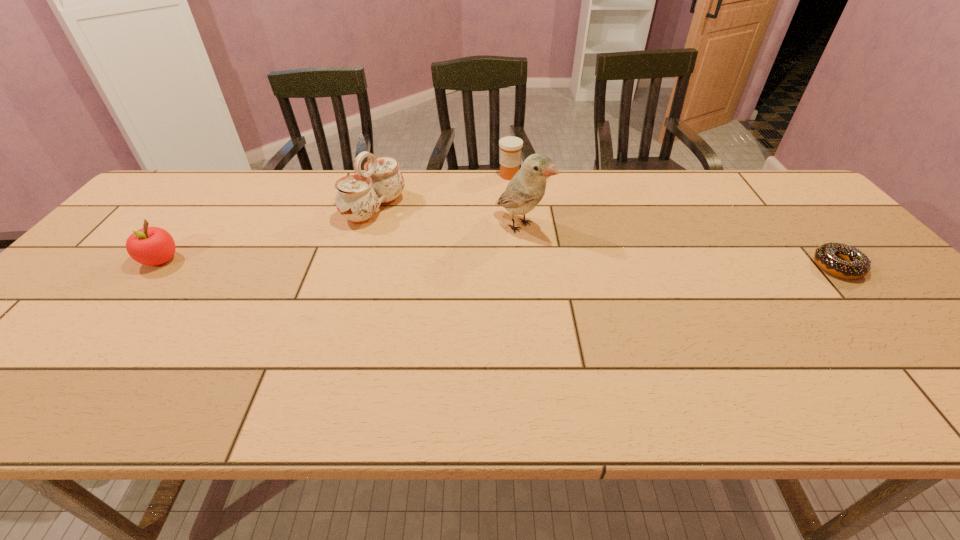
The width and height of the screenshot is (960, 540). What are the coordinates of `free region located by the handle of the chinaware` in the screenshot? It's located at (461, 244).

The width and height of the screenshot is (960, 540). Find the location of `free location located 0.280m by the handle of the chinaware`. free location located 0.280m by the handle of the chinaware is located at coordinates [x=480, y=251].

At what (x,y) coordinates should I click in order to perform the action: click on vacant position located at the face of the tallest object. Please return your answer as a coordinate pair (x, y). This screenshot has width=960, height=540. Looking at the image, I should click on (633, 292).

Find the location of `free point located 0.300m at the face of the tallest object`. free point located 0.300m at the face of the tallest object is located at coordinates (636, 294).

This screenshot has width=960, height=540. In order to click on blank space located at the face of the tallest object in this screenshot , I will do `click(605, 275)`.

Where is `free space located 0.220m on the label of the farthest object`? The image size is (960, 540). free space located 0.220m on the label of the farthest object is located at coordinates (486, 219).

This screenshot has width=960, height=540. Identify the location of vacant space positioned 0.200m on the label of the farthest object. (488, 215).

Find the location of a particular element. free space located on the label of the farthest object is located at coordinates (483, 224).

The width and height of the screenshot is (960, 540). I want to click on chinaware at the far edge, so click(x=358, y=197).

Where is `bird that is at the far edge`? bird that is at the far edge is located at coordinates (526, 189).